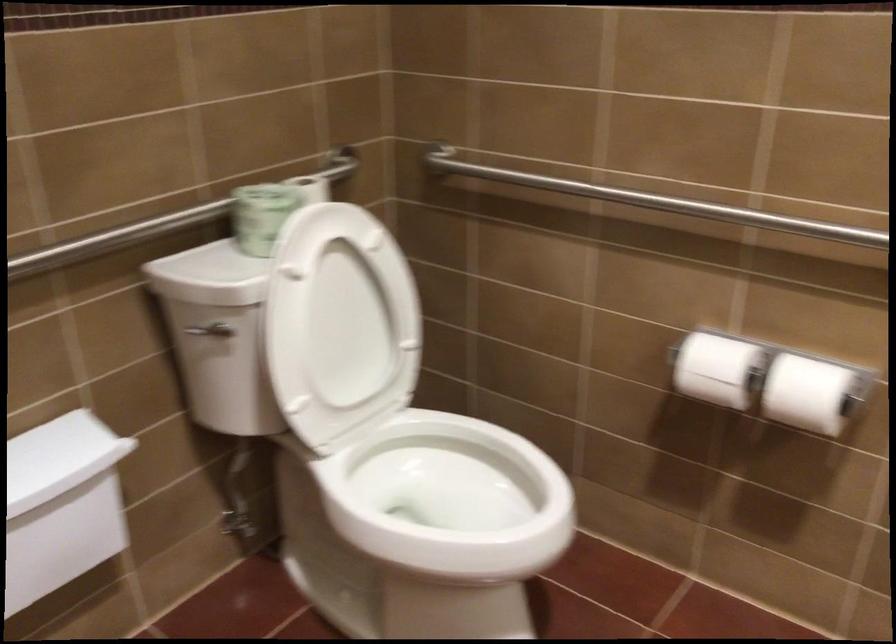
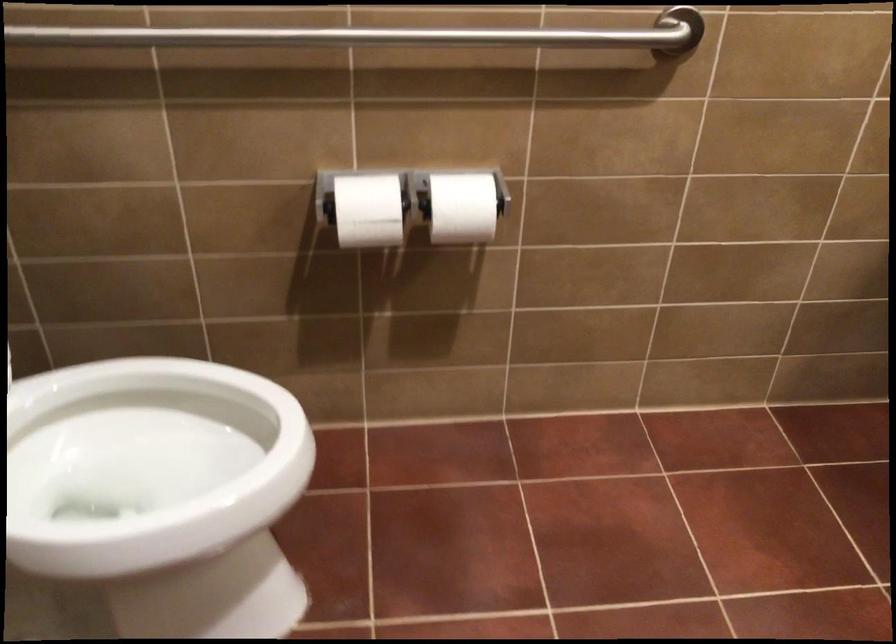
The point at (805, 392) is marked in the first image. Where is the corresponding point in the second image?

(462, 207)